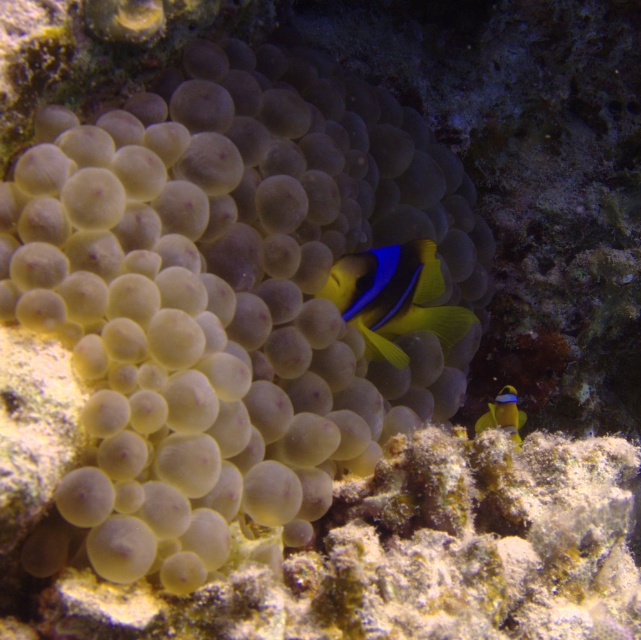
You are an underwater photographer aiming to capture a closeup of the yellow matte clownfish at center and the yellow matte clownfish at lower right. Which one should you focus on if you want to highlight its full height in the photo?

The yellow matte clownfish at center is taller than the yellow matte clownfish at lower right, so focusing on the yellow matte clownfish at center will better highlight its full height.